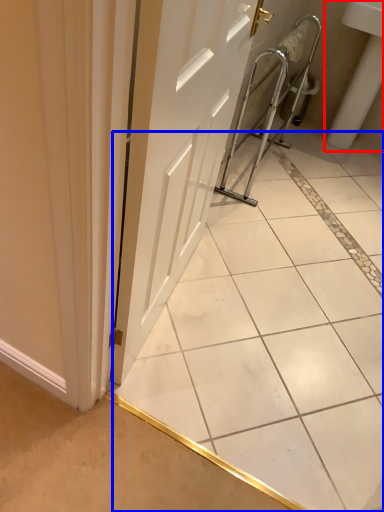
Question: Which object appears closest to the camera in this image, sink (highlighted by a red box) or ceramic tile (highlighted by a blue box)?

Choices:
 (A) sink
 (B) ceramic tile

Answer: (B)